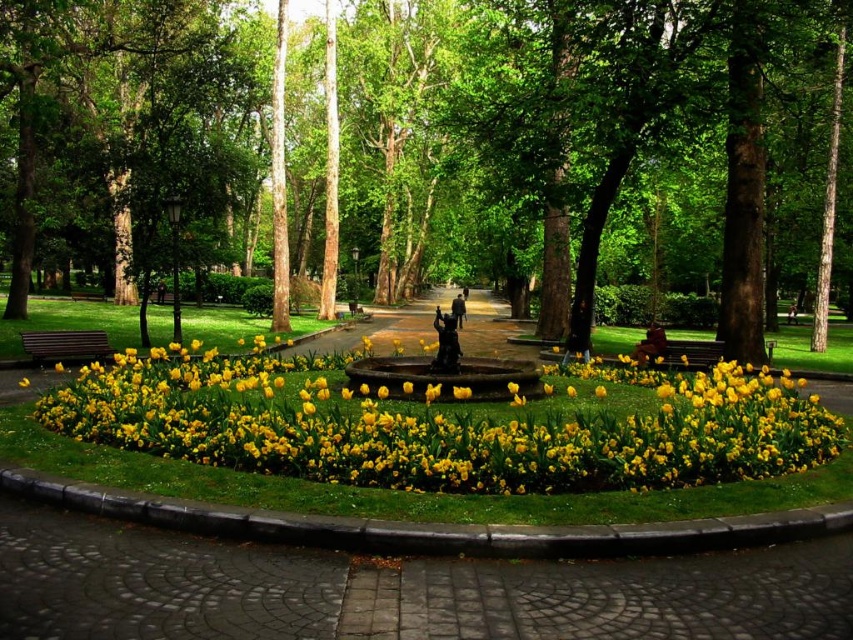
Is yellow matte flowers at center to the left of wooden bench at left from the viewer's perspective?

In fact, yellow matte flowers at center is to the right of wooden bench at left.

In the scene shown: Can you confirm if yellow matte flowers at center is taller than wooden bench at left?

Yes.

Locate an element on the screen. The image size is (853, 640). yellow matte flowers at center is located at coordinates (444, 428).

Does green leafy tree at center appear on the left side of yellow matte flowers at center?

No, green leafy tree at center is not to the left of yellow matte flowers at center.

Which is more to the left, green leafy tree at center or yellow matte flowers at center?

yellow matte flowers at center

Which is in front, point (360, 272) or point (595, 476)?

Positioned in front is point (595, 476).

The image size is (853, 640). Find the location of `green leafy tree at center`. green leafy tree at center is located at coordinates (437, 150).

Is green leafy tree at center thinner than wooden bench at left?

Incorrect, green leafy tree at center's width is not less than wooden bench at left's.

Between green leafy tree at center and wooden bench at left, which one is positioned lower?

wooden bench at left

Is point (560, 330) in front of point (64, 352)?

No.

Locate an element on the screen. green leafy tree at center is located at coordinates [437, 150].